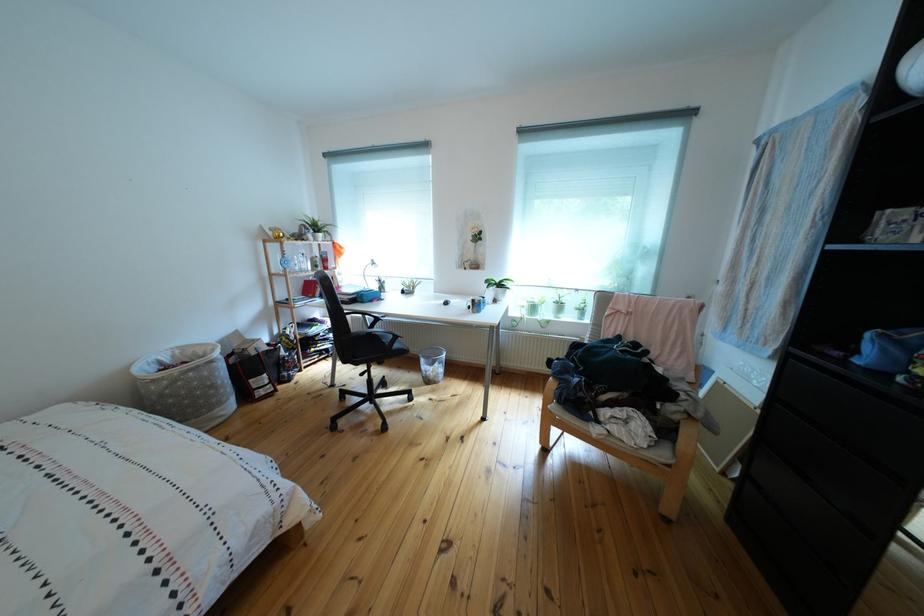
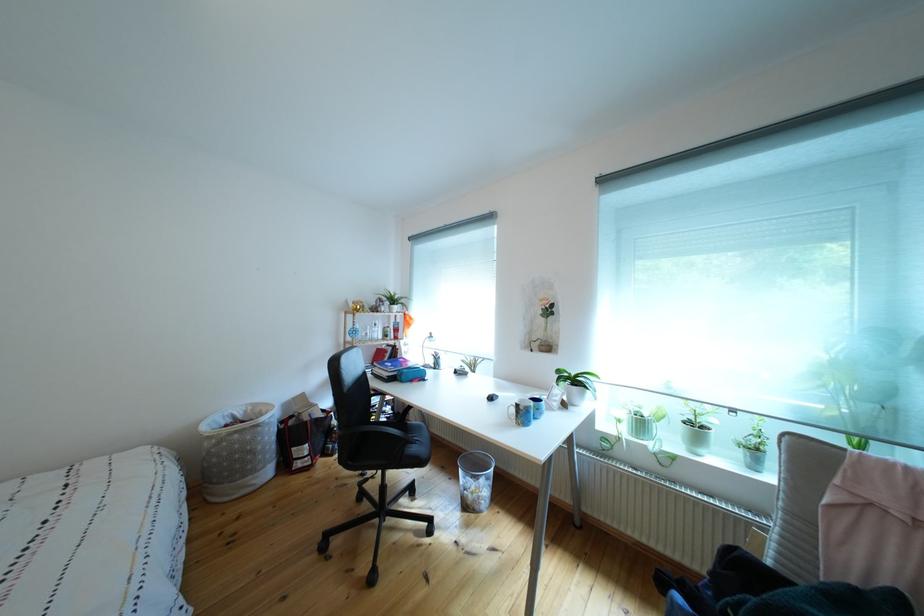
Where in the second image is the point corresponding to (440,387) from the first image?

(477, 512)